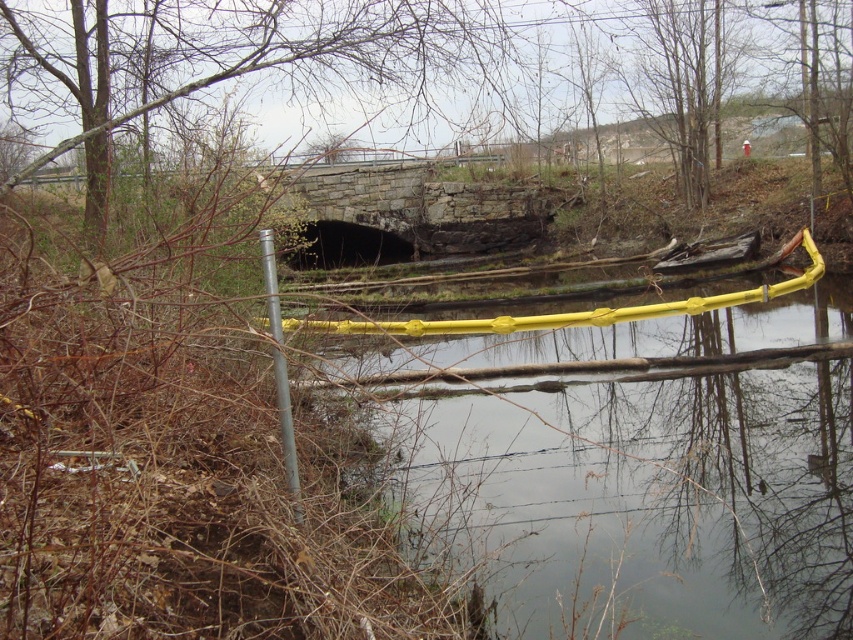
You are a safety inspector assessing the scene. You need to determine if the yellow rubber barrier at lower center is large enough to effectively block access to the hazardous area. Considering the size of the silver metallic pole at left, can the barrier cover the pole completely?

The yellow rubber barrier at lower center has a larger size compared to the silver metallic pole at left, so yes, the barrier can cover the pole completely.